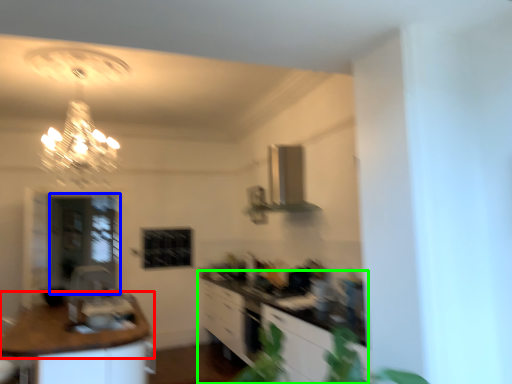
Question: Estimate the real-world distances between objects in this image. Which object is closer to countertop (highlighted by a red box), glass door (highlighted by a blue box) or cabinetry (highlighted by a green box)?

Choices:
 (A) glass door
 (B) cabinetry

Answer: (B)